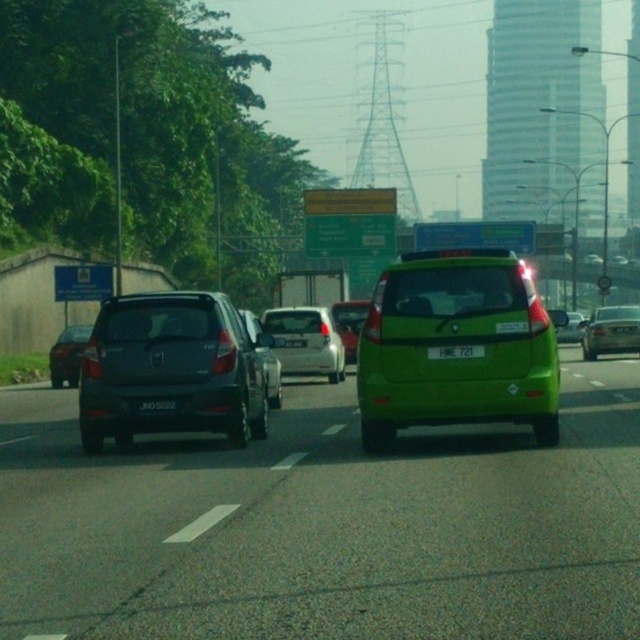
Does point (268, 353) lie behind point (564, 324)?

Yes, point (268, 353) is farther from viewer.

Which is above, shiny silver sedan at center or green matte van at center?

shiny silver sedan at center is higher up.

Is point (248, 314) farther from camera compared to point (572, 314)?

No.

I want to click on shiny silver sedan at center, so click(269, 376).

Between point (64, 340) and point (150, 401), which one is positioned behind?

Point (64, 340)

Between matte black suv at left and black plastic license plate at center, which one is positioned higher?

Positioned higher is black plastic license plate at center.

The width and height of the screenshot is (640, 640). In order to click on matte black suv at left in this screenshot , I will do `click(67, 355)`.

Where is `matte black suv at left`? The width and height of the screenshot is (640, 640). matte black suv at left is located at coordinates (67, 355).

Can you confirm if green matte car at center is positioned to the left of matte black hatchback at left?

Incorrect, green matte car at center is not on the left side of matte black hatchback at left.

Does green matte car at center have a greater width compared to matte black hatchback at left?

Yes, green matte car at center is wider than matte black hatchback at left.

Which is behind, point (628, 404) or point (227, 388)?

Positioned behind is point (628, 404).

In order to click on green matte car at center in this screenshot , I will do `click(326, 525)`.